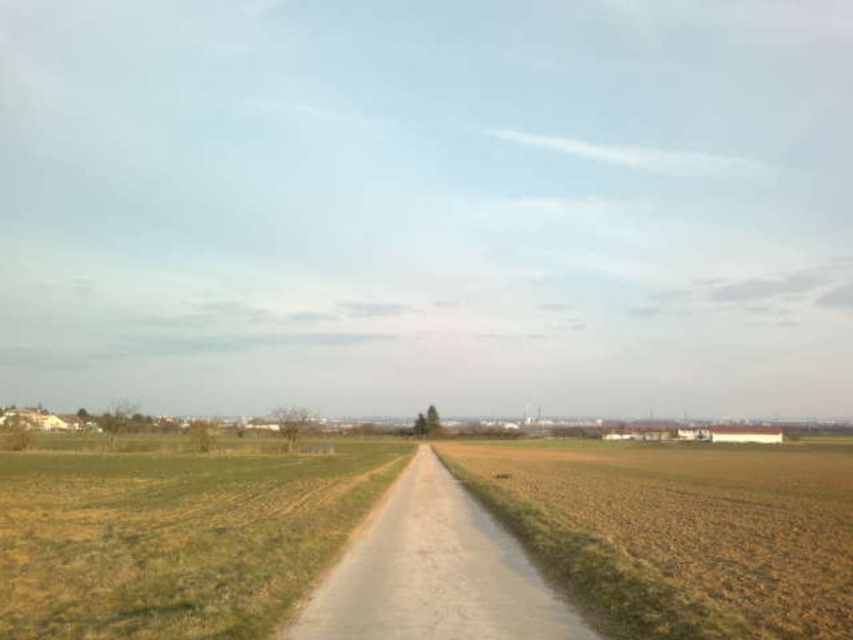
You are standing at the origin point of the image. Looking towards the green grass at lower left, what are the coordinates where you would find it?

The green grass at lower left is located at coordinates point (173, 538).

You are a hiker standing at the edge of the green grass at lower left and want to walk to the dull gray gravel road at center. Which direction should you head to reach the road?

The green grass at lower left is located below the dull gray gravel road at center, so you should head upwards to reach the road.

Looking at this image, you are standing at the center of the dirt road in the middle of the image. You want to walk to the green grass at lower left but need to avoid the brown soil field at lower right. Which direction should you head towards?

You should head towards the left side since the green grass at lower left is on the left side of the brown soil field at lower right, and avoiding the field would require moving away from the right side.